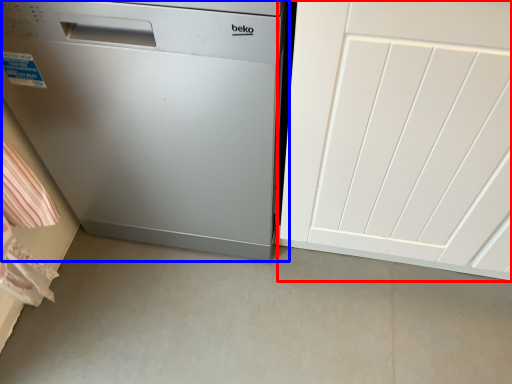
Question: Among these objects, which one is farthest to the camera, door (highlighted by a red box) or home appliance (highlighted by a blue box)?

Choices:
 (A) door
 (B) home appliance

Answer: (B)